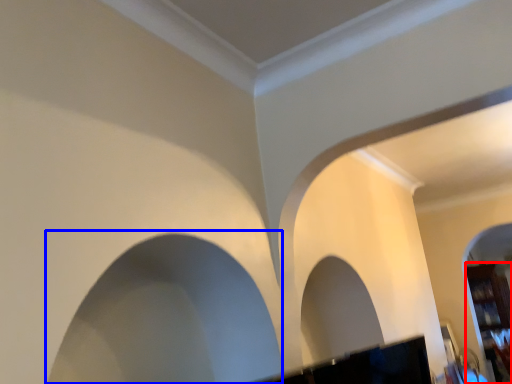
Question: Which object is further to the camera taking this photo, furniture (highlighted by a red box) or rock arch (highlighted by a blue box)?

Choices:
 (A) furniture
 (B) rock arch

Answer: (A)